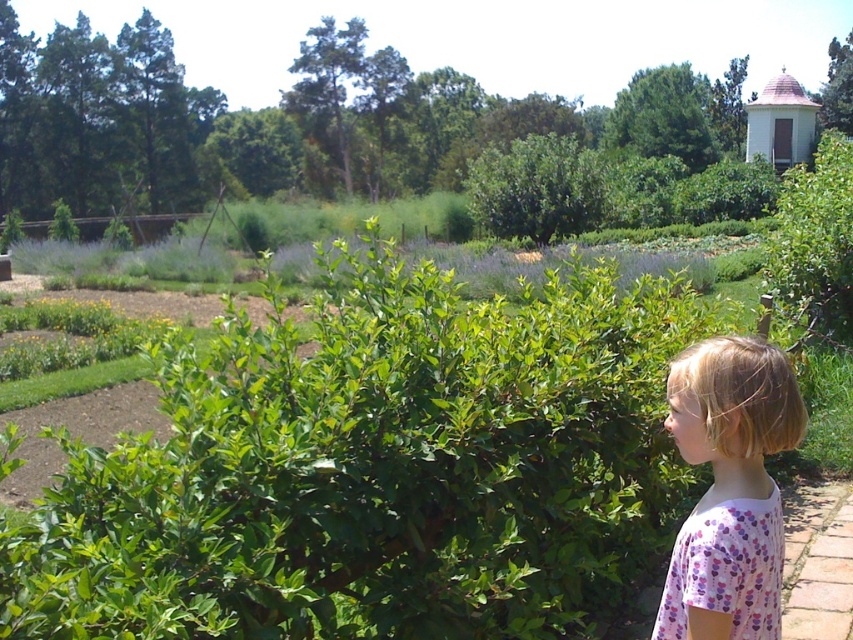
You are a gardener standing at the edge of the brick pavement at lower right. You need to reach the pink floral shirt at lower right to hand the owner a gardening tool. Can you comfortably extend your arm to reach it without stepping onto the brick pavement?

The distance between the pink floral shirt at lower right and the brick pavement at lower right is 8.32 feet. Since the average human arm length is about 2.5 feet, you cannot comfortably reach the pink floral shirt at lower right from the brick pavement at lower right without stepping forward.

You are a gardener standing in the botanical garden scene. You need to water the green leafy bush at upper right and the brick pavement at lower right. Which one should you water first if you want to start with the object closer to you?

You should water the green leafy bush at upper right first because it is closer to you than the brick pavement at lower right.

From the picture: You are a gardener who needs to place a new plant pot between the green leafy bush at center and the brick pavement at lower right. Based on their sizes, which object should you place the pot closer to?

Since the green leafy bush at center is wider than the brick pavement at lower right, you should place the pot closer to the brick pavement at lower right to ensure there is enough space.